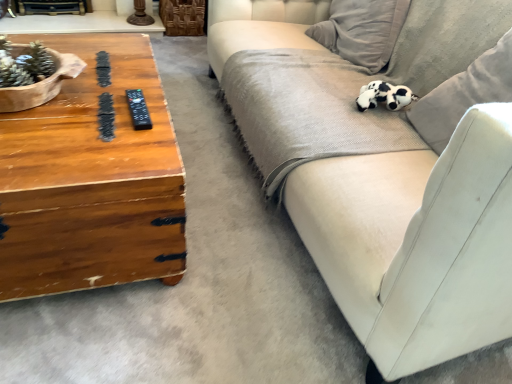
Where is `vacant area that is in front of black plastic remote at left`? vacant area that is in front of black plastic remote at left is located at coordinates (114, 135).